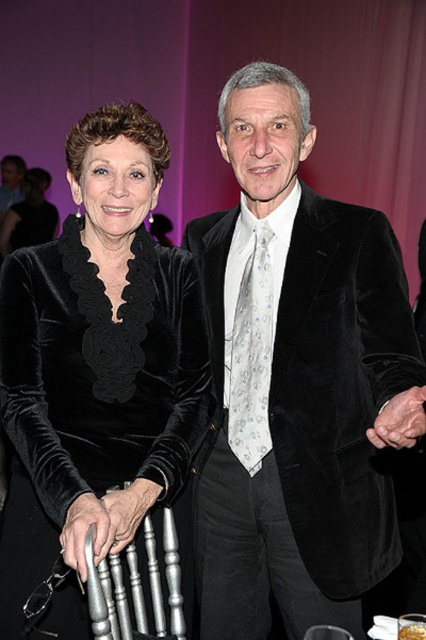
What do you see at coordinates (296, 380) in the screenshot?
I see `velvet black suit at center` at bounding box center [296, 380].

The image size is (426, 640). What are the coordinates of `velvet black suit at center` in the screenshot? It's located at (296, 380).